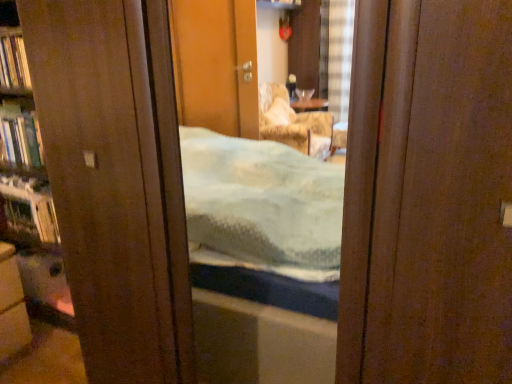
Question: Can you confirm if hardcover book at left, marked as the 1th book in a bottom-to-top arrangement, is positioned to the right of matte brown cabinet at lower left?

Choices:
 (A) yes
 (B) no

Answer: (B)

Question: From the image's perspective, is hardcover book at left, marked as the 1th book in a bottom-to-top arrangement, located above matte brown cabinet at lower left?

Choices:
 (A) yes
 (B) no

Answer: (A)

Question: Does hardcover book at left, marked as the 1th book in a bottom-to-top arrangement, come behind matte brown cabinet at lower left?

Choices:
 (A) yes
 (B) no

Answer: (A)

Question: Considering the relative sizes of hardcover book at left, acting as the 2th book starting from the top, and matte brown cabinet at lower left in the image provided, is hardcover book at left, acting as the 2th book starting from the top, thinner than matte brown cabinet at lower left?

Choices:
 (A) yes
 (B) no

Answer: (A)

Question: From the image's perspective, is hardcover book at left, acting as the 2th book starting from the top, beneath matte brown cabinet at lower left?

Choices:
 (A) yes
 (B) no

Answer: (B)

Question: Can you see hardcover book at left, acting as the 2th book starting from the top, touching matte brown cabinet at lower left?

Choices:
 (A) yes
 (B) no

Answer: (B)

Question: Does hardcover book at left, marked as the 1th book in a bottom-to-top arrangement, have a greater height compared to hardcover book at left, the second book ordered from the bottom?

Choices:
 (A) no
 (B) yes

Answer: (A)

Question: Considering the relative sizes of hardcover book at left, marked as the 1th book in a bottom-to-top arrangement, and hardcover book at left, the 1th book from the top, in the image provided, is hardcover book at left, marked as the 1th book in a bottom-to-top arrangement, bigger than hardcover book at left, the 1th book from the top,?

Choices:
 (A) yes
 (B) no

Answer: (B)

Question: Is hardcover book at left, acting as the 2th book starting from the top, positioned before hardcover book at left, the 1th book from the top?

Choices:
 (A) yes
 (B) no

Answer: (B)

Question: From a real-world perspective, is hardcover book at left, marked as the 1th book in a bottom-to-top arrangement, physically above hardcover book at left, the second book ordered from the bottom?

Choices:
 (A) no
 (B) yes

Answer: (A)

Question: Considering the relative positions of hardcover book at left, marked as the 1th book in a bottom-to-top arrangement, and hardcover book at left, the second book ordered from the bottom, in the image provided, is hardcover book at left, marked as the 1th book in a bottom-to-top arrangement, to the left of hardcover book at left, the second book ordered from the bottom, from the viewer's perspective?

Choices:
 (A) no
 (B) yes

Answer: (B)

Question: From the image's perspective, would you say hardcover book at left, acting as the 2th book starting from the top, is shown under hardcover book at left, the 1th book from the top?

Choices:
 (A) no
 (B) yes

Answer: (B)

Question: Considering the relative positions of metallic silver shelf at left and matte brown cabinet at lower left in the image provided, is metallic silver shelf at left to the right of matte brown cabinet at lower left from the viewer's perspective?

Choices:
 (A) no
 (B) yes

Answer: (B)